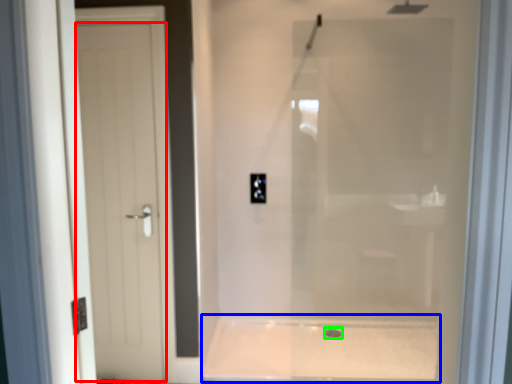
Question: Considering the real-world distances, which object is farthest from door (highlighted by a red box)? bath (highlighted by a blue box) or drain (highlighted by a green box)?

Choices:
 (A) bath
 (B) drain

Answer: (B)